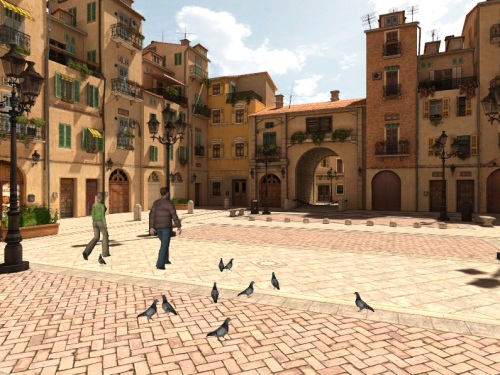
This screenshot has height=375, width=500. Find the location of `archways`. archways is located at coordinates (390, 173), (493, 177), (324, 150), (269, 172), (175, 173), (155, 176), (123, 172), (20, 178).